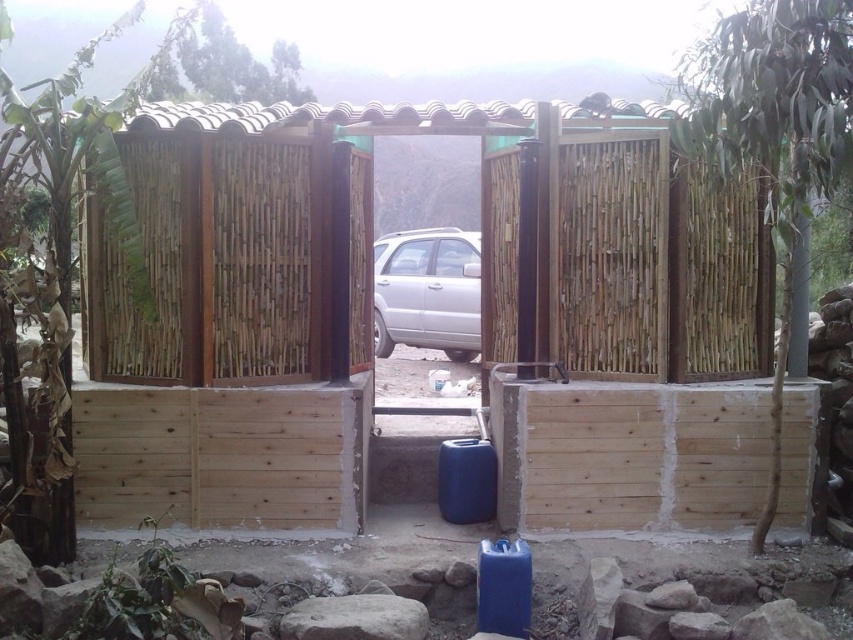
You are standing in front of the natural wood fence at center and the satin silver car at center. Which object is nearer to you?

The natural wood fence at center is closer to the viewer than the satin silver car at center, so the natural wood fence at center is nearer to you.

Based on the photo, you are standing at the gate and want to place a small flag at the point that is closer to you. Which point should you choose between point (592, 221) and point (474, 310)?

Point (592, 221) is closer to the camera, so you should place the flag there.

From the picture: You are driving a vehicle and want to enter through the gate. Based on the scene, which object should you pass first, the natural wood fence at center or the satin silver car at center?

You should pass the satin silver car at center first because the natural wood fence at center is to the right of the satin silver car at center, meaning the car is positioned in front of the fence from your perspective.